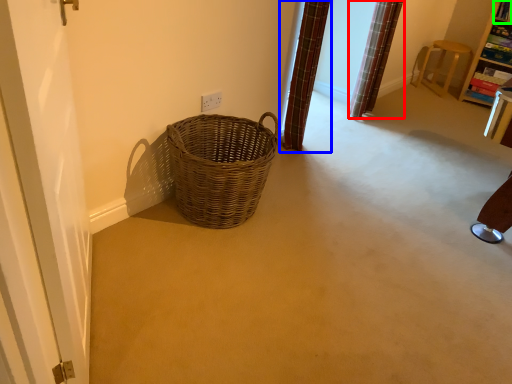
Question: Considering the real-world distances, which object is closest to curtain (highlighted by a red box)? curtain (highlighted by a blue box) or shelf (highlighted by a green box).

Choices:
 (A) curtain
 (B) shelf

Answer: (A)